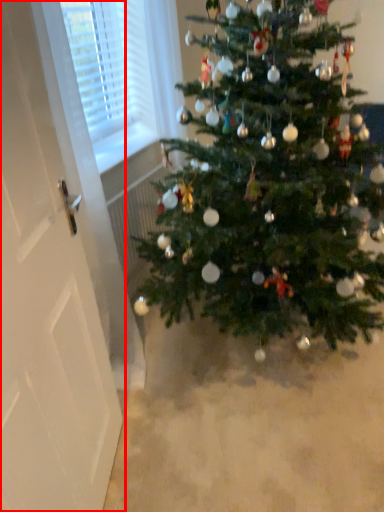
Question: From the image's perspective, where is screen door (annotated by the red box) located relative to christmas tree?

Choices:
 (A) above
 (B) below

Answer: (B)